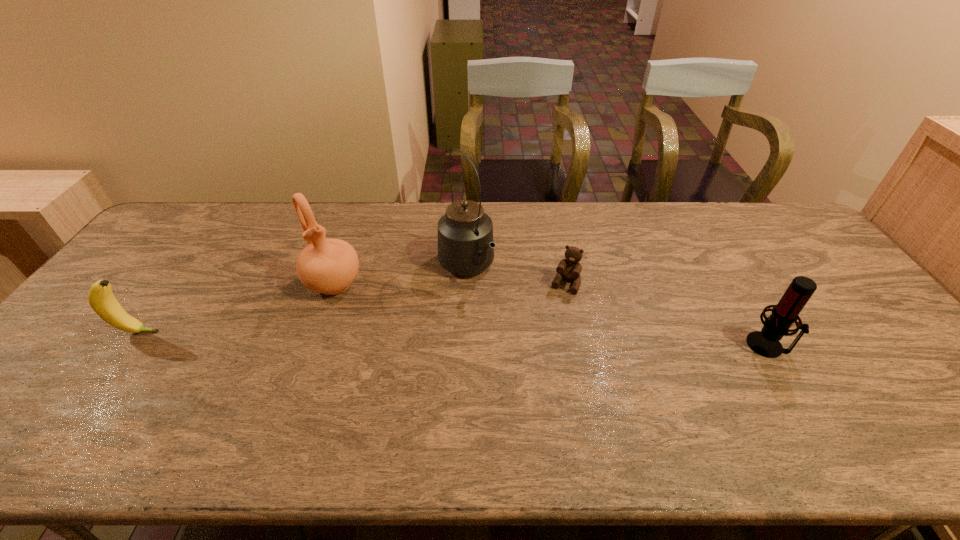
Find the location of a particular element. The image size is (960, 540). the fourth tallest object is located at coordinates (100, 297).

Where is `banana`? This screenshot has width=960, height=540. banana is located at coordinates (100, 297).

At what (x,y) coordinates should I click in order to perform the action: click on the rightmost object. Please return your answer as a coordinate pair (x, y). Looking at the image, I should click on (766, 342).

This screenshot has height=540, width=960. Identify the location of the third shortest object. (766, 342).

Where is `the second tallest object`? This screenshot has width=960, height=540. the second tallest object is located at coordinates (329, 266).

The width and height of the screenshot is (960, 540). Find the location of `the second object from left to right`. the second object from left to right is located at coordinates (329, 266).

Locate an element on the screen. the shortest object is located at coordinates (569, 269).

Find the location of a particular element. The width and height of the screenshot is (960, 540). the second object from right to left is located at coordinates (569, 269).

Locate an element on the screen. This screenshot has width=960, height=540. kettle is located at coordinates click(x=466, y=246).

This screenshot has width=960, height=540. Identify the location of the third object from left to right. (466, 246).